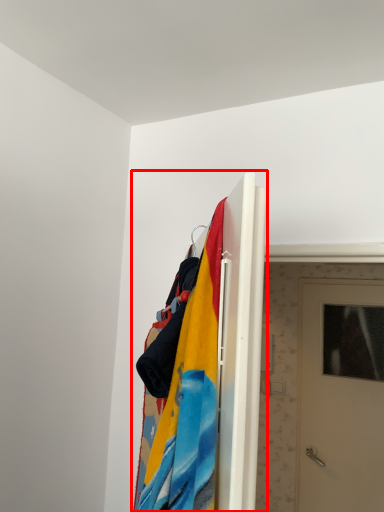
Question: In this image, where is closet (annotated by the red box) located relative to door?

Choices:
 (A) left
 (B) right

Answer: (A)